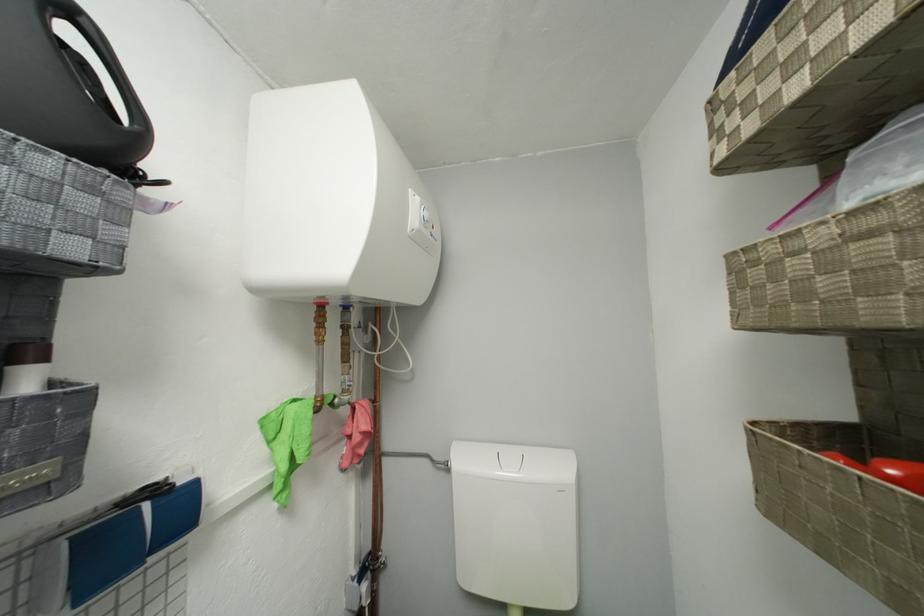
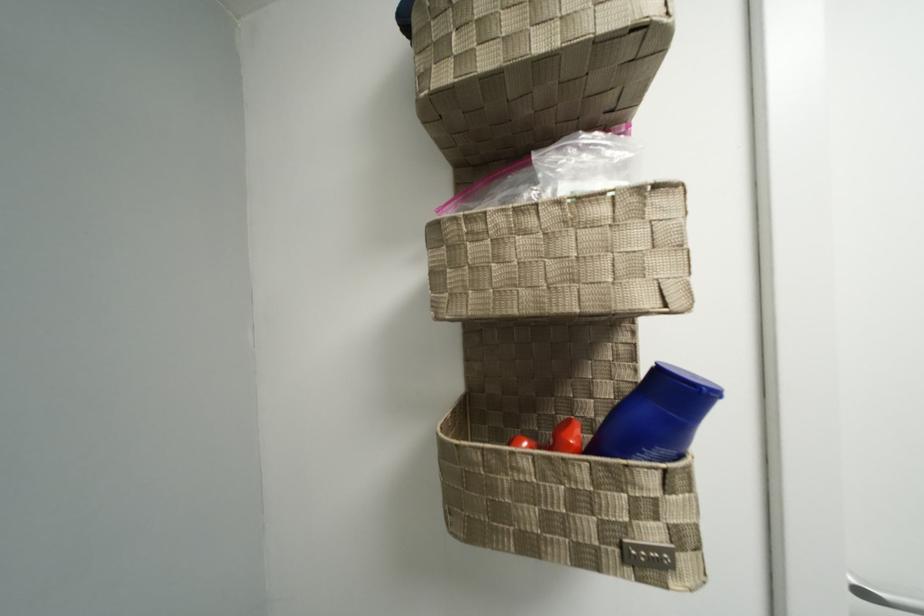
Question: The first image is from the beginning of the video and the second image is from the end. How did the camera likely rotate when shooting the video?

Choices:
 (A) Left
 (B) Right
 (C) Up
 (D) Down

Answer: (B)